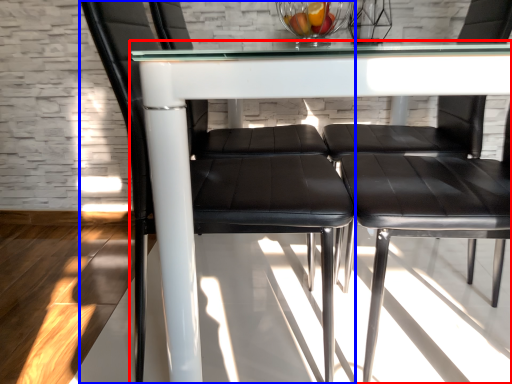
Question: Which of the following is the farthest to the observer, table (highlighted by a red box) or chair (highlighted by a blue box)?

Choices:
 (A) table
 (B) chair

Answer: (B)